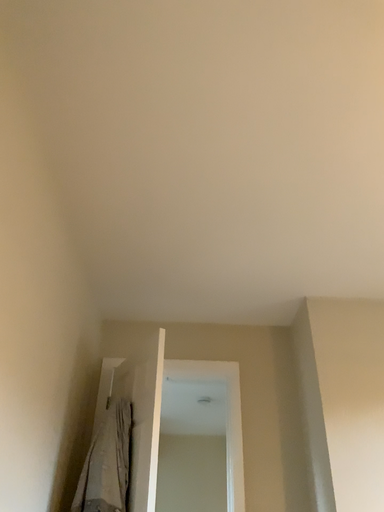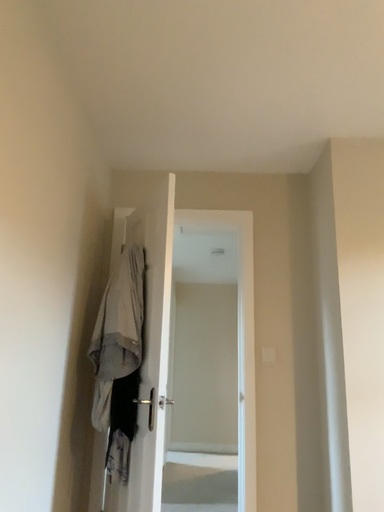
Question: How did the camera likely rotate when shooting the video?

Choices:
 (A) rotated downward
 (B) rotated upward

Answer: (A)